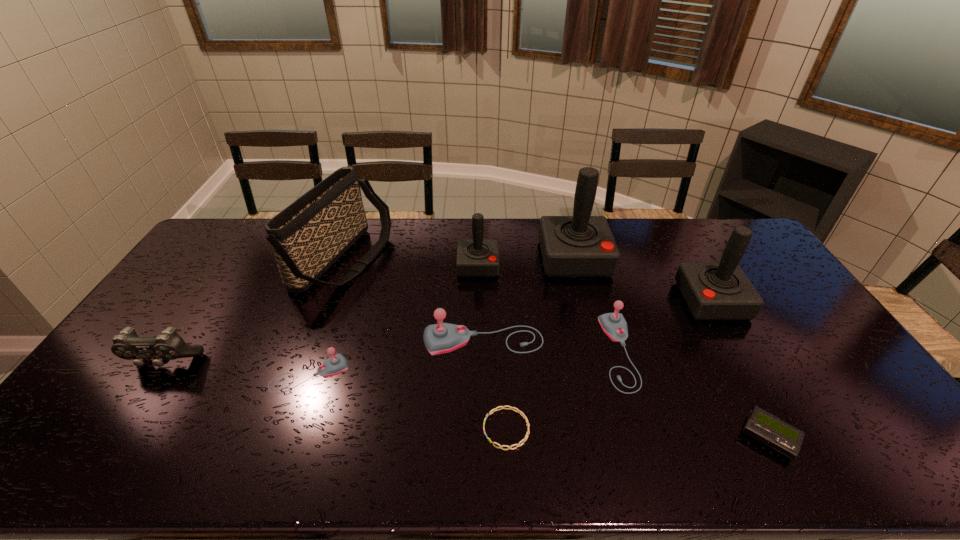
Where is `the second shortest joystick`? The image size is (960, 540). the second shortest joystick is located at coordinates (614, 325).

Where is `the fourth shortest object`? the fourth shortest object is located at coordinates (614, 325).

Locate an element on the screen. the shortest joystick is located at coordinates (336, 364).

Image resolution: width=960 pixels, height=540 pixels. I want to click on the third shortest object, so click(336, 364).

Identify the location of the second shortest object. (766, 428).

At what (x,y) coordinates should I click in order to perform the action: click on bracelet. Please return your answer as a coordinate pair (x, y). Looking at the image, I should click on (502, 407).

I want to click on blue bracelet, so click(502, 407).

What are the coordinates of `vacant space located on the base of the biggest red joystick` in the screenshot? It's located at pos(587,305).

You are a GUI agent. You are given a task and a screenshot of the screen. Output one action in this format:
    pyautogui.click(x=<x>, y=<y>)
    Task: Click on the free region located on the base of the fifth shortest joystick
    The image size is (960, 540).
    Given the screenshot: What is the action you would take?
    pyautogui.click(x=623, y=301)

The image size is (960, 540). Identify the location of vacant space situated 0.300m on the base of the fifth shortest joystick. (588, 301).